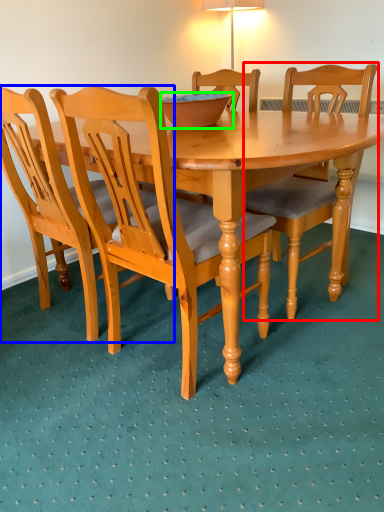
Question: Considering the real-world distances, which object is closest to chair (highlighted by a red box)? chair (highlighted by a blue box) or bowl (highlighted by a green box).

Choices:
 (A) chair
 (B) bowl

Answer: (B)